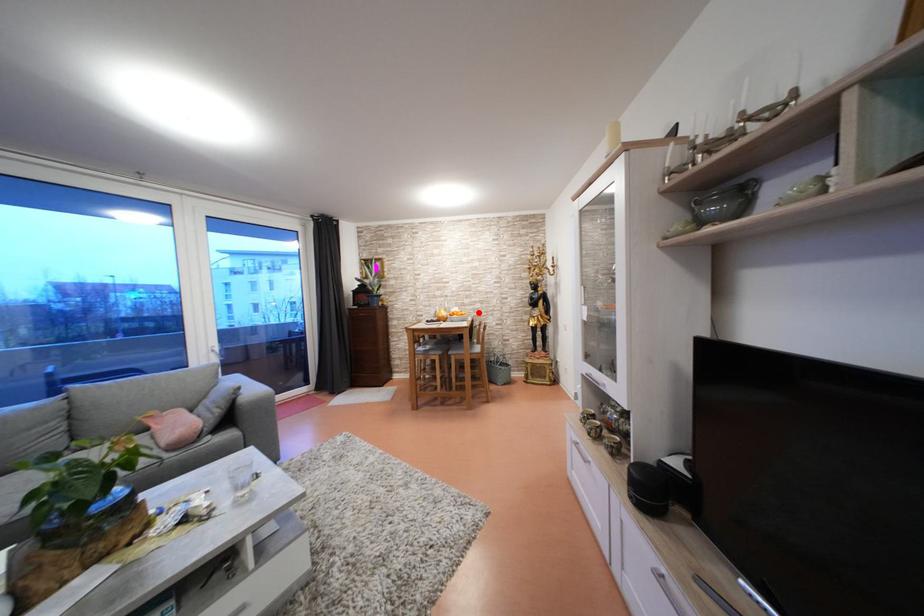
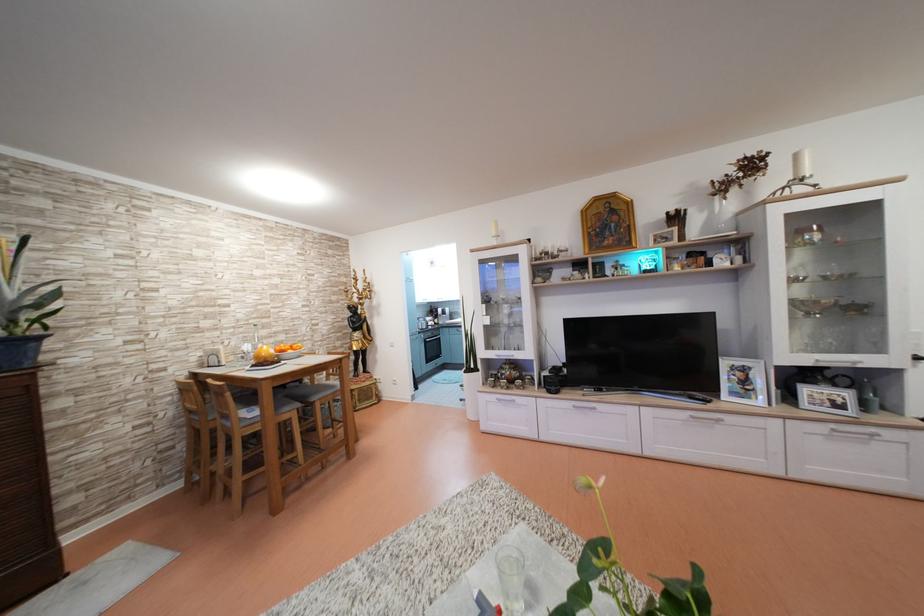
Locate, in the second image, the point that corresponds to the highlighted location in the first image.

(280, 345)